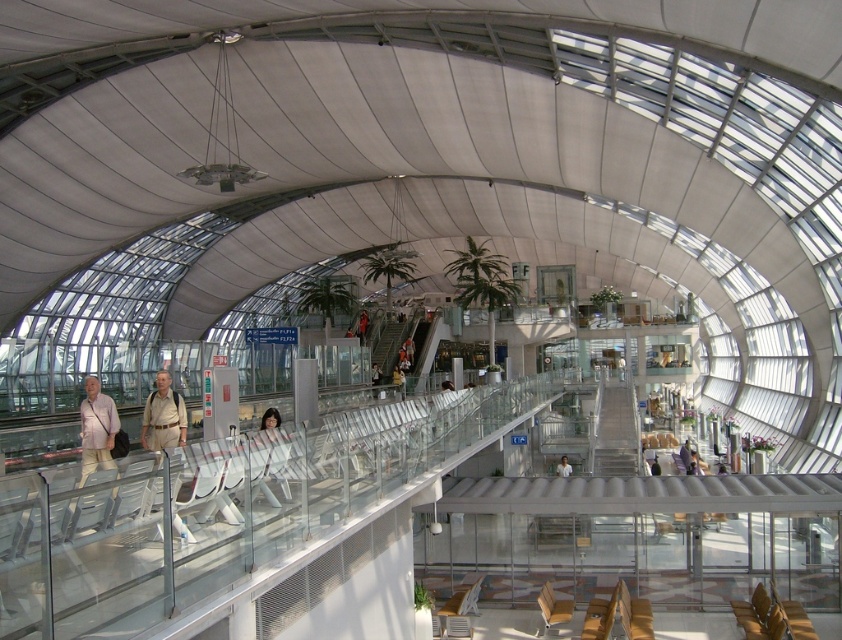
Question: Among these points, which one is farthest from the camera?

Choices:
 (A) (360, 323)
 (B) (658, 467)

Answer: (A)

Question: Among these objects, which one is nearest to the camera?

Choices:
 (A) dark brown leather jacket at center
 (B) white fabric shirt at center
 (C) light beige shirt at center
 (D) tan fabric pants at lower left

Answer: (C)

Question: Does light beige shirt at center lie in front of white fabric shirt at center?

Choices:
 (A) no
 (B) yes

Answer: (B)

Question: Observing the image, what is the correct spatial positioning of tan fabric pants at lower left in reference to dark brown leather jacket at center?

Choices:
 (A) right
 (B) left

Answer: (A)

Question: Does light beige shirt at center appear under dark gray fabric jacket at center?

Choices:
 (A) no
 (B) yes

Answer: (A)

Question: Which object is the farthest from the tan fabric pants at lower left?

Choices:
 (A) light beige shirt at center
 (B) dark brown leather jacket at center
 (C) dark gray fabric jacket at center

Answer: (B)